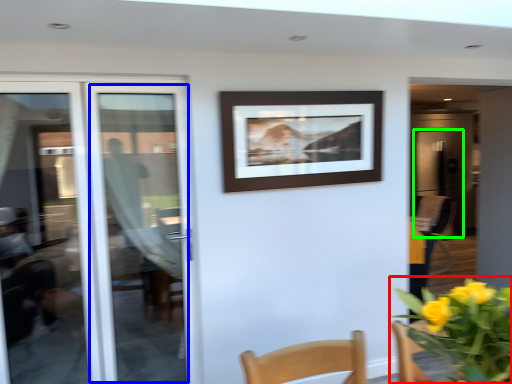
Question: Which is nearer to the floral arrangement (highlighted by a red box)? door (highlighted by a blue box) or screen door (highlighted by a green box).

Choices:
 (A) door
 (B) screen door

Answer: (A)